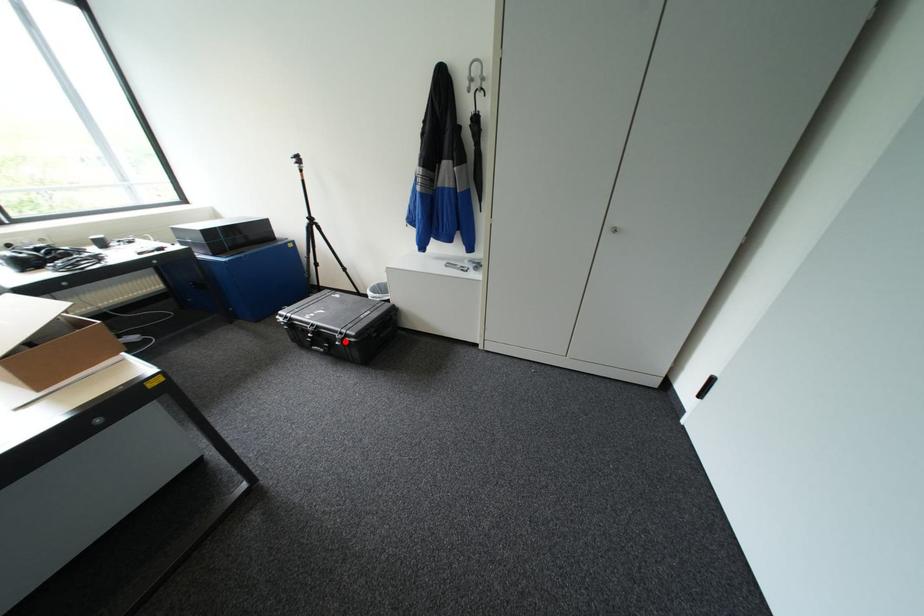
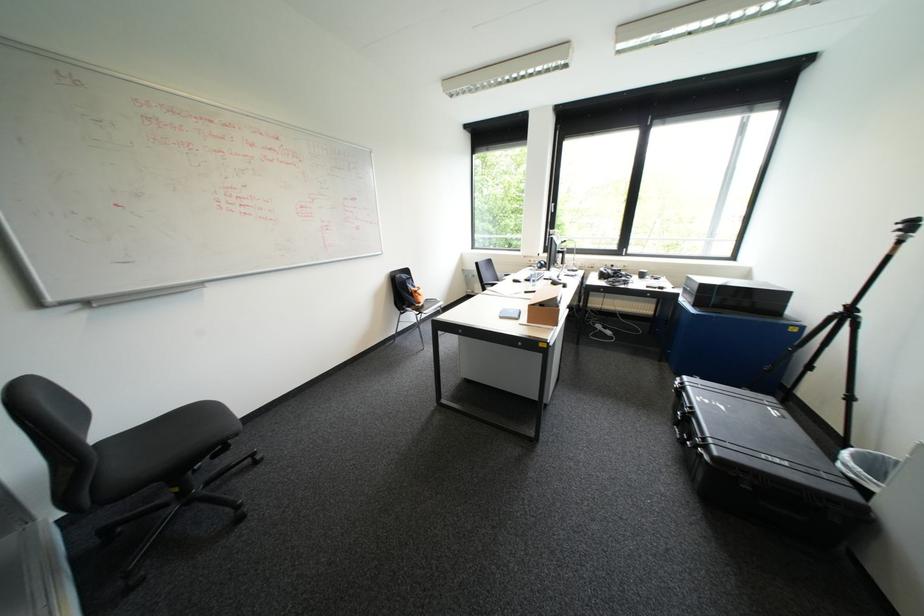
Question: I am providing you with two images of the same scene from different viewpoints. Image1 has a red point marked. In image2, the corresponding 3D location appears at what relative position? Reply with the corresponding letter.

Choices:
 (A) Closer
 (B) Farther

Answer: (A)